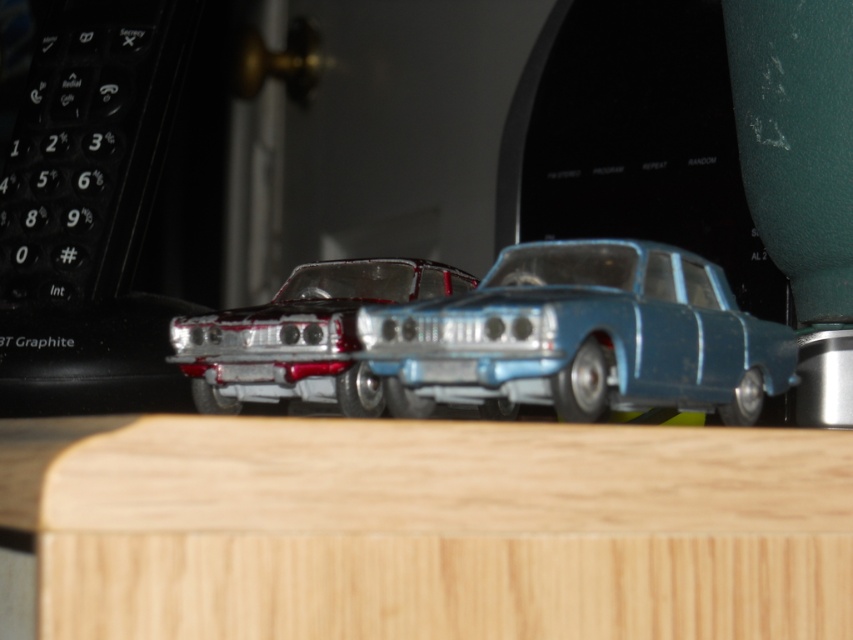
Does light wood table at center lie behind blue metallic car at center?

No.

Which is below, light wood table at center or blue metallic car at center?

Positioned lower is light wood table at center.

Does point (167, 508) come farther from viewer compared to point (654, 358)?

No.

Where is `light wood table at center`? light wood table at center is located at coordinates (428, 528).

Can you confirm if light wood table at center is smaller than shiny metallic car at center?

Incorrect, light wood table at center is not smaller in size than shiny metallic car at center.

Which is in front, point (670, 480) or point (259, 376)?

Point (670, 480) is in front.

Is point (625, 444) closer to camera compared to point (215, 371)?

Yes, it is.

Where is `light wood table at center`? light wood table at center is located at coordinates 428,528.

Who is positioned more to the left, blue metallic car at center or shiny metallic car at center?

shiny metallic car at center is more to the left.

Is point (541, 369) closer to camera compared to point (335, 314)?

Yes, it is in front of point (335, 314).

Image resolution: width=853 pixels, height=640 pixels. Identify the location of blue metallic car at center. (583, 337).